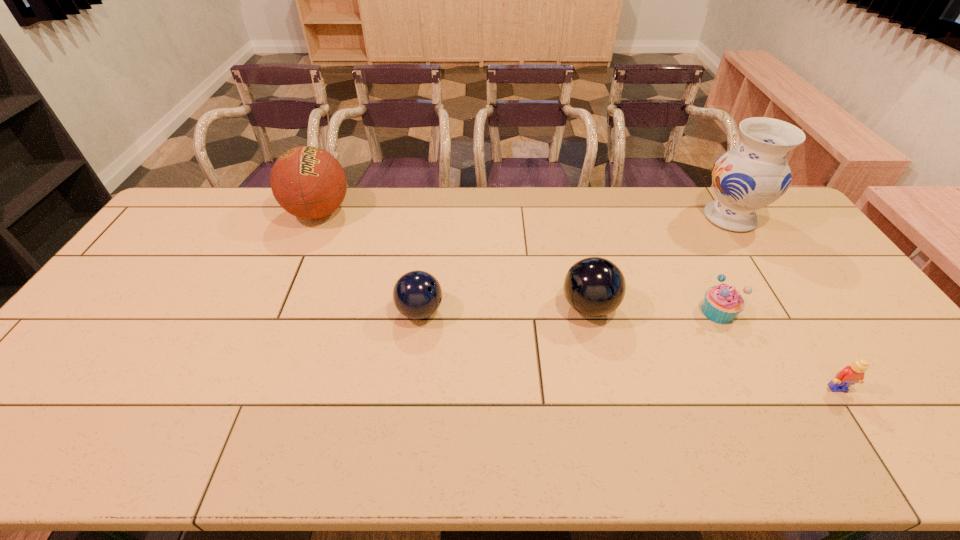
Find the location of `object situated at the far right corner`. object situated at the far right corner is located at coordinates (754, 174).

This screenshot has width=960, height=540. I want to click on vacant area at the far edge of the desktop, so click(552, 199).

Find the location of a particular element. Image resolution: width=960 pixels, height=540 pixels. free region at the near edge of the desktop is located at coordinates (348, 447).

The height and width of the screenshot is (540, 960). I want to click on vacant space at the left edge of the desktop, so click(53, 400).

Find the location of a particular element. vacant space at the far left corner of the desktop is located at coordinates (209, 213).

In the image, there is a desktop. Where is `vacant space at the far right corner`? vacant space at the far right corner is located at coordinates (775, 205).

Identify the location of unoccupied position between the right bowling ball and the fifth shortest object. This screenshot has width=960, height=540. (454, 260).

Where is `unoccupied position between the fourth shortest object and the third object from right to left`? Image resolution: width=960 pixels, height=540 pixels. unoccupied position between the fourth shortest object and the third object from right to left is located at coordinates (654, 309).

Locate an element on the screen. The height and width of the screenshot is (540, 960). unoccupied area between the tallest object and the second tallest object is located at coordinates (524, 215).

Locate an element on the screen. free space between the tallest object and the muffin is located at coordinates (724, 265).